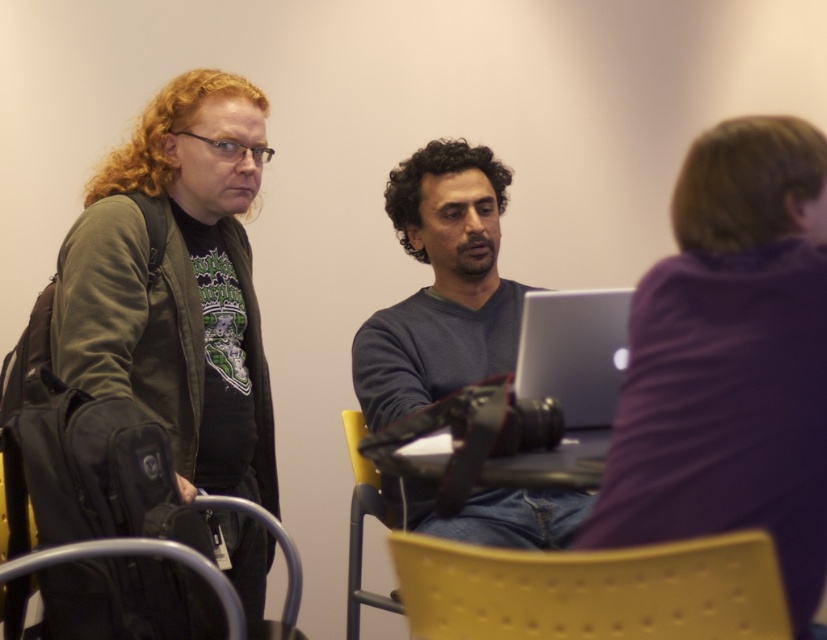
Question: Does matte black jacket at left have a smaller size compared to dark blue sweater at center?

Choices:
 (A) yes
 (B) no

Answer: (B)

Question: Which of these objects is positioned closest to the dark blue sweater at center?

Choices:
 (A) yellow plastic chair at lower center
 (B) purple matte shirt at upper right
 (C) metallic gray chair at lower left
 (D) matte black jacket at left

Answer: (D)

Question: Which object is the closest to the matte black jacket at left?

Choices:
 (A) yellow plastic chair at lower center
 (B) purple matte shirt at upper right
 (C) dark blue sweater at center

Answer: (C)

Question: Which point is farther to the camera?

Choices:
 (A) (31, 561)
 (B) (464, 600)
 (C) (663, 340)

Answer: (A)

Question: Observing the image, what is the correct spatial positioning of matte black jacket at left in reference to dark blue sweater at center?

Choices:
 (A) left
 (B) right

Answer: (A)

Question: Can you confirm if dark blue sweater at center is smaller than metallic gray chair at lower left?

Choices:
 (A) yes
 (B) no

Answer: (B)